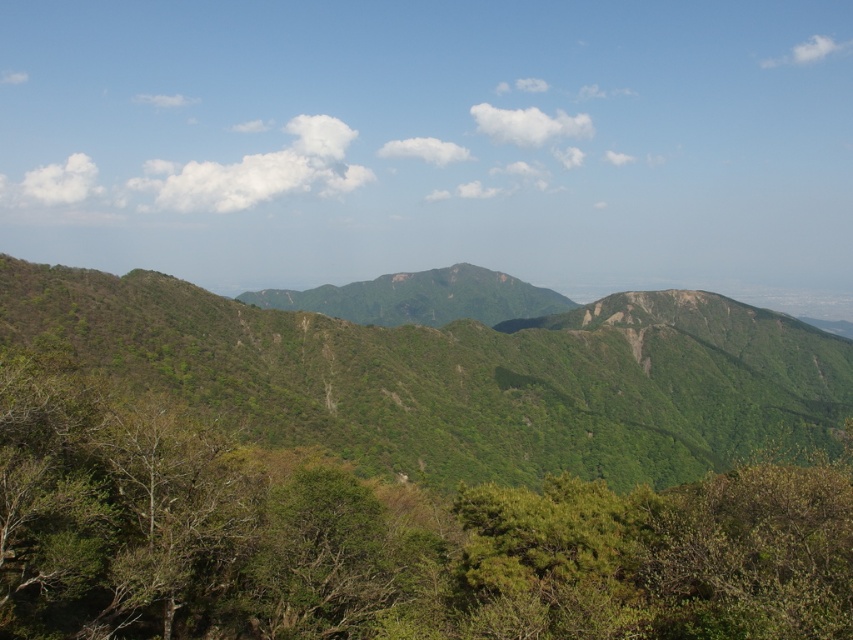
Where is `green leafy tree at center`? The image size is (853, 640). green leafy tree at center is located at coordinates (381, 538).

Measure the distance between green leafy tree at center and camera.

green leafy tree at center and camera are 29.61 meters apart from each other.

This screenshot has height=640, width=853. I want to click on green leafy tree at center, so click(x=381, y=538).

Who is more distant from viewer, (186,300) or (479,298)?

The point (479,298) is more distant.

Which of these two, green leafy mountain at center or green rocky mountain at center, stands taller?

green leafy mountain at center is taller.

Does point (413, 436) lie in front of point (277, 296)?

Yes, point (413, 436) is closer to viewer.

Where is `green leafy mountain at center`? Image resolution: width=853 pixels, height=640 pixels. green leafy mountain at center is located at coordinates (461, 376).

Is point (625, 577) behind point (498, 296)?

No, it is not.

In the scene shown: Does green leafy tree at center appear under green rocky mountain at center?

Yes, green leafy tree at center is below green rocky mountain at center.

Who is more distant from viewer, (416, 593) or (456, 289)?

Point (456, 289)

At what (x,y) coordinates should I click in order to perform the action: click on green leafy tree at center. Please return your answer as a coordinate pair (x, y). This screenshot has width=853, height=640. Looking at the image, I should click on (381, 538).